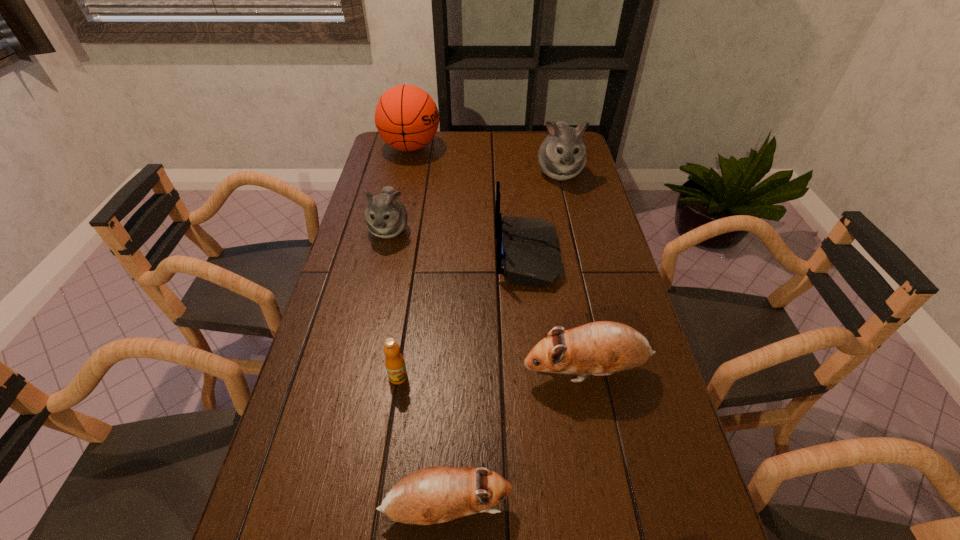
I want to click on vacant space located on the front label of the orange juice, so click(x=389, y=441).

This screenshot has height=540, width=960. I want to click on free space located at the face of the nearest object, so click(x=588, y=510).

The image size is (960, 540). In order to click on basketball at the far edge in this screenshot , I will do `click(406, 117)`.

I want to click on hamster that is at the far edge, so click(562, 155).

Find the location of a particular element. basketball that is at the left edge is located at coordinates (406, 117).

Identify the location of hamster at the left edge. (385, 217).

At what (x,y) coordinates should I click in order to perform the action: click on object positioned at the far left corner. Please return your answer as a coordinate pair (x, y). The width and height of the screenshot is (960, 540). Looking at the image, I should click on (406, 117).

Identify the location of object situated at the far right corner. point(562,155).

Where is `vacant space at the far edge of the desktop`? vacant space at the far edge of the desktop is located at coordinates (497, 153).

This screenshot has height=540, width=960. Find the location of `free spot at the left edge of the desktop`. free spot at the left edge of the desktop is located at coordinates (372, 243).